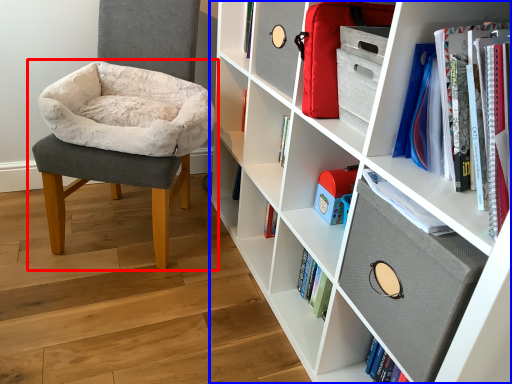
Question: Which point is further to the camera, chair (highlighted by a red box) or shelf (highlighted by a blue box)?

Choices:
 (A) chair
 (B) shelf

Answer: (A)